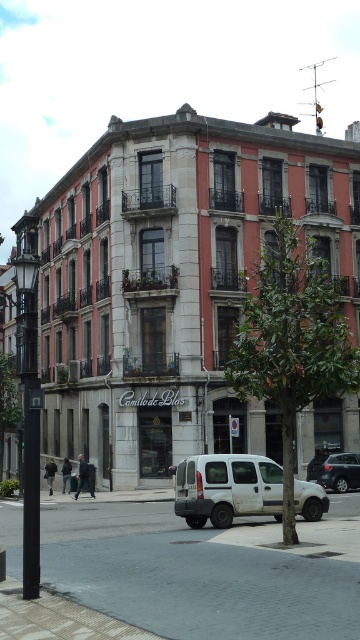
Does black metal pole at left have a greater height compared to metallic silver van at center?

Yes, black metal pole at left is taller than metallic silver van at center.

Is black metal pole at left shorter than metallic silver van at center?

No, black metal pole at left is not shorter than metallic silver van at center.

Identify the location of black metal pole at left. The height and width of the screenshot is (640, 360). (29, 394).

At what (x,y) coordinates should I click in order to perform the action: click on black metal pole at left. Please return your answer as a coordinate pair (x, y). Looking at the image, I should click on (29, 394).

This screenshot has width=360, height=640. I want to click on white matte van at lower center, so click(x=227, y=488).

Between white matte van at lower center and metallic silver van at center, which one is positioned higher?

white matte van at lower center is above.

From the picture: Who is more forward, [249,460] or [357,458]?

Point [249,460] is in front.

Where is `white matte van at lower center`? white matte van at lower center is located at coordinates (227, 488).

Does white matte van at lower center have a smaller size compared to black metal pole at left?

Yes, white matte van at lower center is smaller than black metal pole at left.

Measure the distance between white matte van at lower center and black metal pole at left.

A distance of 9.65 meters exists between white matte van at lower center and black metal pole at left.

Is point (194, 516) farther from viewer compared to point (29, 595)?

Yes, it is.

Find the location of a particular element. This screenshot has height=640, width=360. white matte van at lower center is located at coordinates (227, 488).